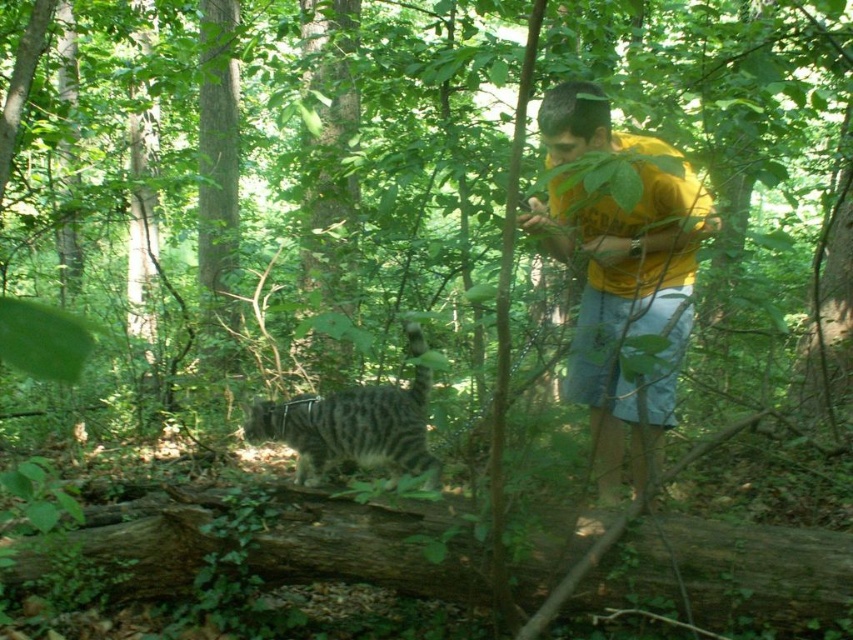
Between yellow cotton shirt at center and striped fur cat at center, which one has more height?

With more height is yellow cotton shirt at center.

Does point (589, 216) come closer to viewer compared to point (300, 408)?

Yes, point (589, 216) is in front of point (300, 408).

Locate an element on the screen. The width and height of the screenshot is (853, 640). yellow cotton shirt at center is located at coordinates click(616, 260).

Can you confirm if brown rough log at lower center is positioned to the right of striped fur cat at center?

Correct, you'll find brown rough log at lower center to the right of striped fur cat at center.

Does brown rough log at lower center have a greater height compared to striped fur cat at center?

No, brown rough log at lower center is not taller than striped fur cat at center.

Does point (675, 554) come farther from viewer compared to point (422, 420)?

That is False.

This screenshot has height=640, width=853. What are the coordinates of `brown rough log at lower center` in the screenshot? It's located at (724, 572).

Is point (592, 602) behind point (563, 104)?

No.

Can you confirm if brown rough log at lower center is positioned above yellow cotton shirt at center?

No, brown rough log at lower center is not above yellow cotton shirt at center.

Measure the distance between brown rough log at lower center and camera.

They are 2.70 meters apart.

Where is `brown rough log at lower center`? brown rough log at lower center is located at coordinates (724, 572).